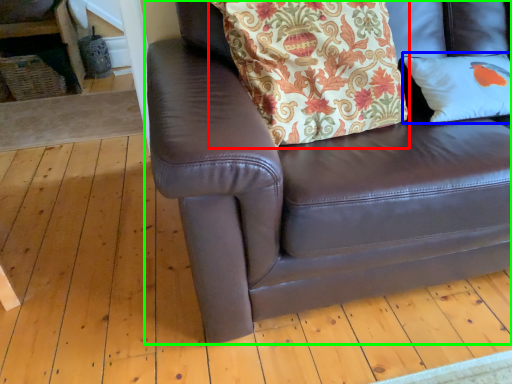
Question: Estimate the real-world distances between objects in this image. Which object is farther from blanket (highlighted by a red box), pillow (highlighted by a blue box) or studio couch (highlighted by a green box)?

Choices:
 (A) pillow
 (B) studio couch

Answer: (A)